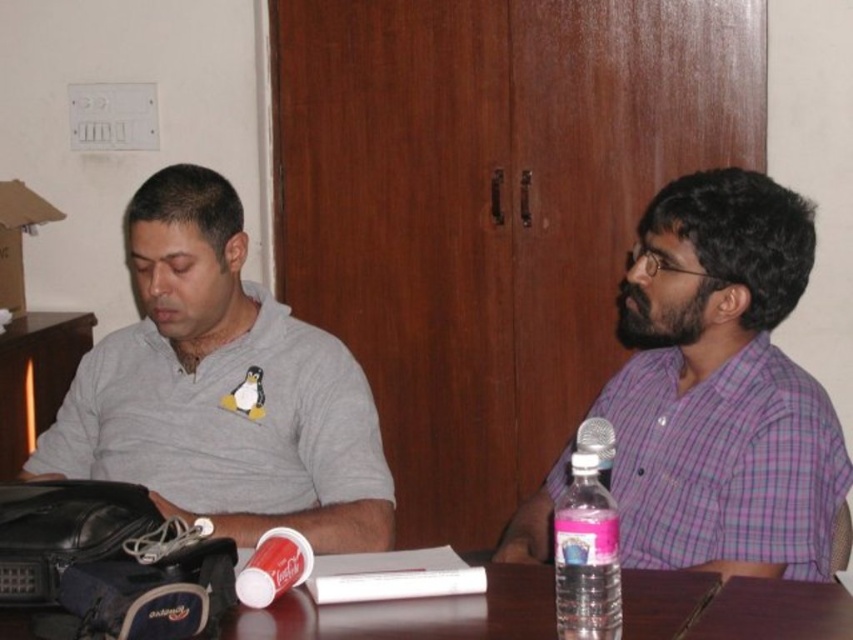
You are a photographer setting up for a group photo. You need to position the gray matte shirt at left and the silver metallic microphone at right in such a way that they are aligned with the center of the frame. Given their current positions, which object should you move to achieve this alignment?

Since the gray matte shirt at left is to the left of the silver metallic microphone at right, you should move the gray matte shirt at left to the right to align both with the center of the frame.

You are standing 2 meters away from the point at coordinates point (325, 333). If you walk towards it, will you be able to reach it within 3 steps?

The distance of point (325, 333) from viewer is 1.78 meters. Since you are already 2 meters away, you are farther than the point, so walking towards it would require moving backward. Therefore, you cannot reach it within 3 steps.

You are a photographer adjusting your camera to capture a photo of two points in the scene. You need to focus on the closer point first. Which point should you focus on first between the point at coordinate [787,484] and the point at coordinate [213,508]?

The point at coordinate [787,484] is closer to the camera than the point at coordinate [213,508], so you should focus on the point at coordinate [787,484] first.